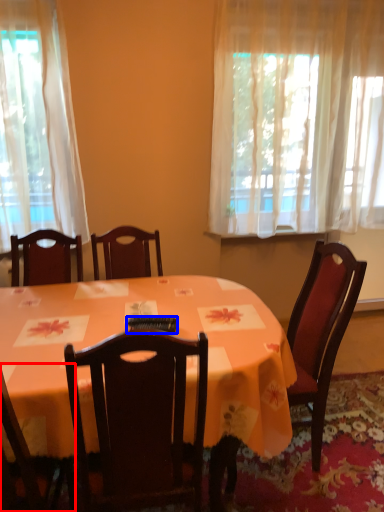
Question: Which object appears farthest to the camera in this image, chair (highlighted by a red box) or remote control (highlighted by a blue box)?

Choices:
 (A) chair
 (B) remote control

Answer: (B)